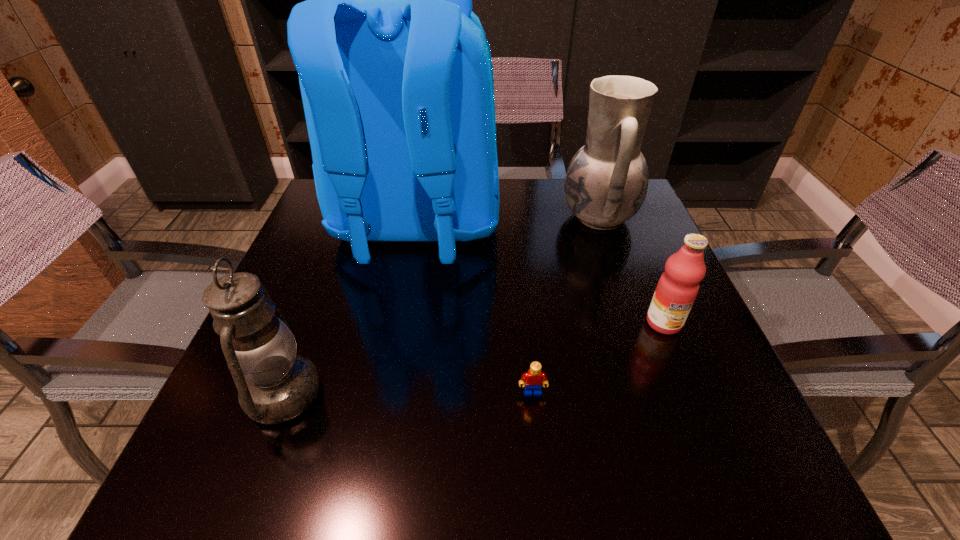
Locate an element on the screen. the tallest object is located at coordinates (395, 71).

Locate an element on the screen. The image size is (960, 540). pitcher is located at coordinates (606, 183).

Where is `oil lamp`? The height and width of the screenshot is (540, 960). oil lamp is located at coordinates (275, 385).

I want to click on fruit juice, so click(677, 288).

Where is `the second shortest object`? The image size is (960, 540). the second shortest object is located at coordinates (677, 288).

Identify the location of the shortest object. The image size is (960, 540). (532, 379).

This screenshot has width=960, height=540. I want to click on Lego, so click(x=532, y=379).

Locate an element on the screen. Image resolution: width=960 pixels, height=540 pixels. vacant space located 0.360m on the back of the backpack is located at coordinates (377, 444).

This screenshot has width=960, height=540. In order to click on vacant space located on the front-facing side of the pitcher in this screenshot , I will do `click(452, 217)`.

I want to click on vacant space located on the front-facing side of the pitcher, so click(531, 217).